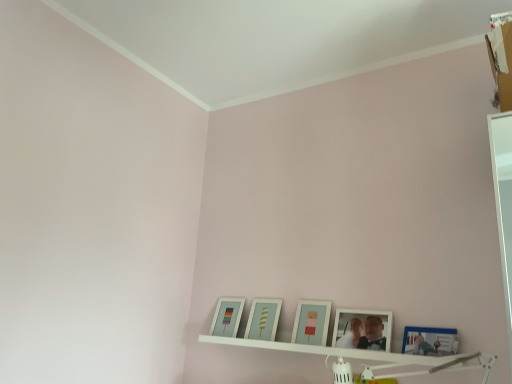
Question: Is white matte picture frame at lower center, placed as the second picture frame when sorted from right to left, shorter than matte glass picture frame at lower left, the 1th picture frame in the left-to-right sequence?

Choices:
 (A) yes
 (B) no

Answer: (A)

Question: Is the depth of white matte picture frame at lower center, positioned as the fourth picture frame in left-to-right order, greater than that of matte glass picture frame at lower left, which is counted as the 5th picture frame, starting from the right?

Choices:
 (A) yes
 (B) no

Answer: (B)

Question: Would you say matte glass picture frame at lower left, the 1th picture frame in the left-to-right sequence, is part of white matte picture frame at lower center, placed as the second picture frame when sorted from right to left,'s contents?

Choices:
 (A) yes
 (B) no

Answer: (B)

Question: Considering the relative positions of white matte picture frame at lower center, placed as the second picture frame when sorted from right to left, and matte glass picture frame at lower left, the 1th picture frame in the left-to-right sequence, in the image provided, is white matte picture frame at lower center, placed as the second picture frame when sorted from right to left, to the left of matte glass picture frame at lower left, the 1th picture frame in the left-to-right sequence, from the viewer's perspective?

Choices:
 (A) yes
 (B) no

Answer: (B)

Question: Is white matte picture frame at lower center, placed as the second picture frame when sorted from right to left, looking in the opposite direction of matte glass picture frame at lower left, the 1th picture frame in the left-to-right sequence?

Choices:
 (A) yes
 (B) no

Answer: (B)

Question: From the image's perspective, is white matte picture frame at lower center, positioned as the fourth picture frame in left-to-right order, beneath matte glass picture frame at lower left, the 1th picture frame in the left-to-right sequence?

Choices:
 (A) no
 (B) yes

Answer: (A)

Question: Does blue glossy picture frame at lower right, which ranks as the 5th picture frame in left-to-right order, appear on the right side of white matte picture frame at lower center, positioned as the fourth picture frame in left-to-right order?

Choices:
 (A) no
 (B) yes

Answer: (B)

Question: From the image's perspective, is blue glossy picture frame at lower right, which is the 1th picture frame in right-to-left order, under white matte picture frame at lower center, placed as the second picture frame when sorted from right to left?

Choices:
 (A) no
 (B) yes

Answer: (B)

Question: Does blue glossy picture frame at lower right, which ranks as the 5th picture frame in left-to-right order, have a lesser width compared to white matte picture frame at lower center, positioned as the fourth picture frame in left-to-right order?

Choices:
 (A) no
 (B) yes

Answer: (B)

Question: Is blue glossy picture frame at lower right, which is the 1th picture frame in right-to-left order, turned away from white matte picture frame at lower center, placed as the second picture frame when sorted from right to left?

Choices:
 (A) yes
 (B) no

Answer: (B)

Question: Considering the relative sizes of blue glossy picture frame at lower right, which is the 1th picture frame in right-to-left order, and white matte picture frame at lower center, placed as the second picture frame when sorted from right to left, in the image provided, is blue glossy picture frame at lower right, which is the 1th picture frame in right-to-left order, smaller than white matte picture frame at lower center, placed as the second picture frame when sorted from right to left,?

Choices:
 (A) no
 (B) yes

Answer: (B)

Question: Is blue glossy picture frame at lower right, which is the 1th picture frame in right-to-left order, in front of white matte picture frame at lower center, positioned as the fourth picture frame in left-to-right order?

Choices:
 (A) no
 (B) yes

Answer: (B)

Question: Is white matte picture frame at lower center, positioned as the fourth picture frame in left-to-right order, to the left of matte white picture frame at center, placed as the fourth picture frame when sorted from right to left, from the viewer's perspective?

Choices:
 (A) no
 (B) yes

Answer: (A)